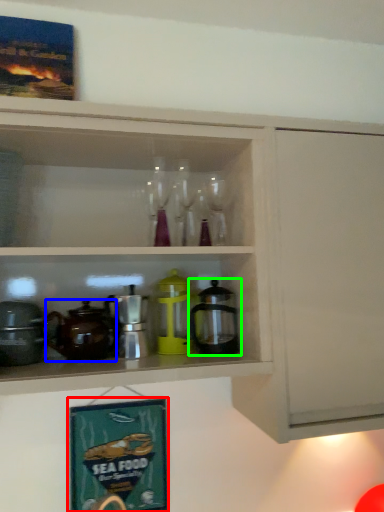
Question: Estimate the real-world distances between objects in this image. Which object is farther from picture frame (highlighted by a red box), coffeepot (highlighted by a blue box) or coffeepot (highlighted by a green box)?

Choices:
 (A) coffeepot
 (B) coffeepot

Answer: (B)